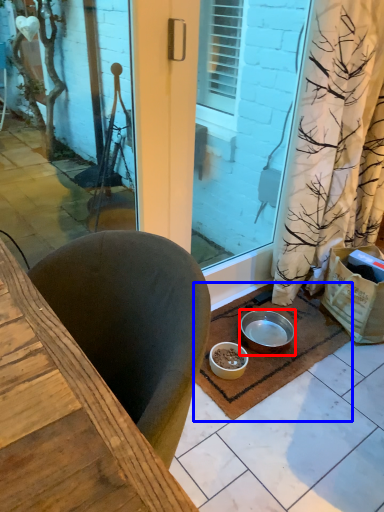
Question: Which of the following is the closest to the observer, bowl (highlighted by a red box) or doormat (highlighted by a blue box)?

Choices:
 (A) bowl
 (B) doormat

Answer: (B)